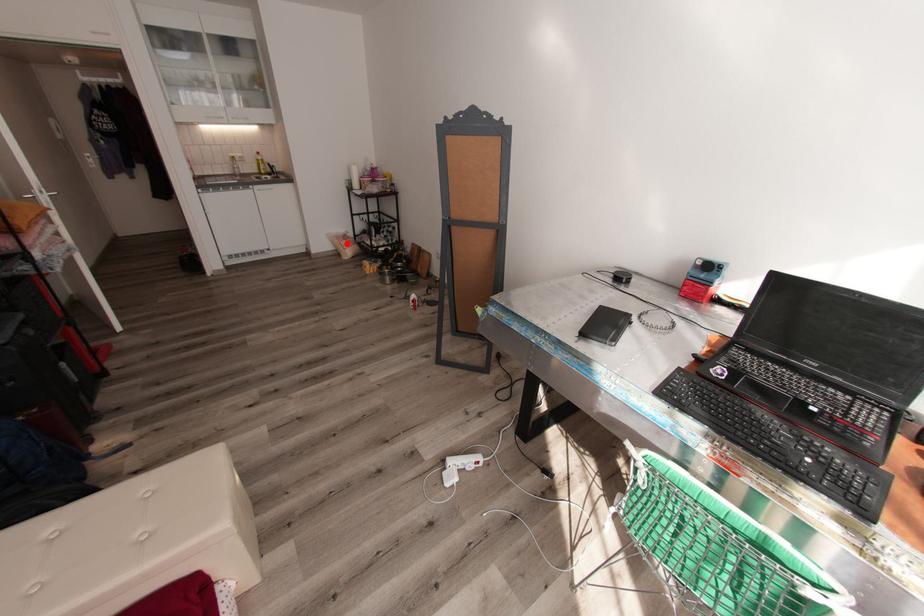
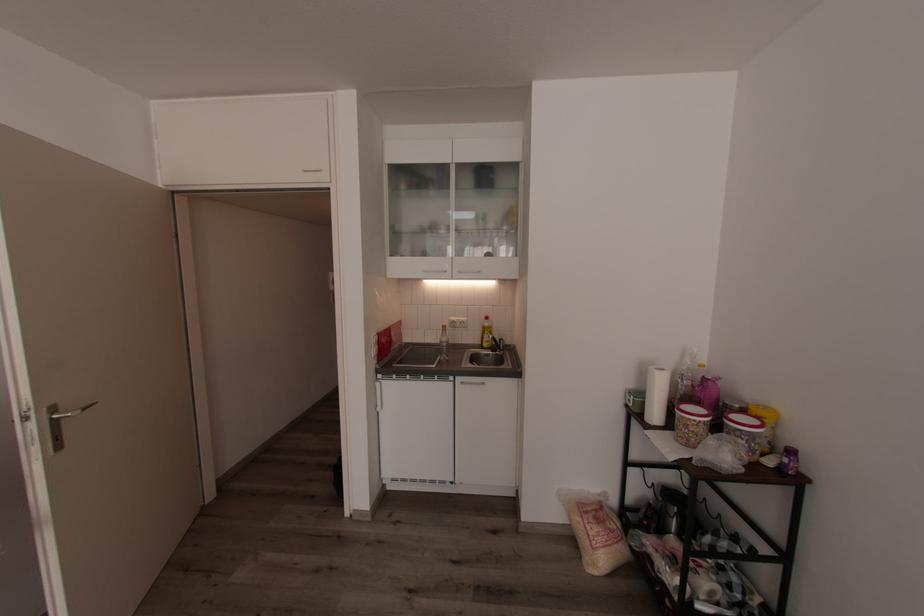
In the second image, find the point that corresponds to the highlighted location in the first image.

(594, 533)